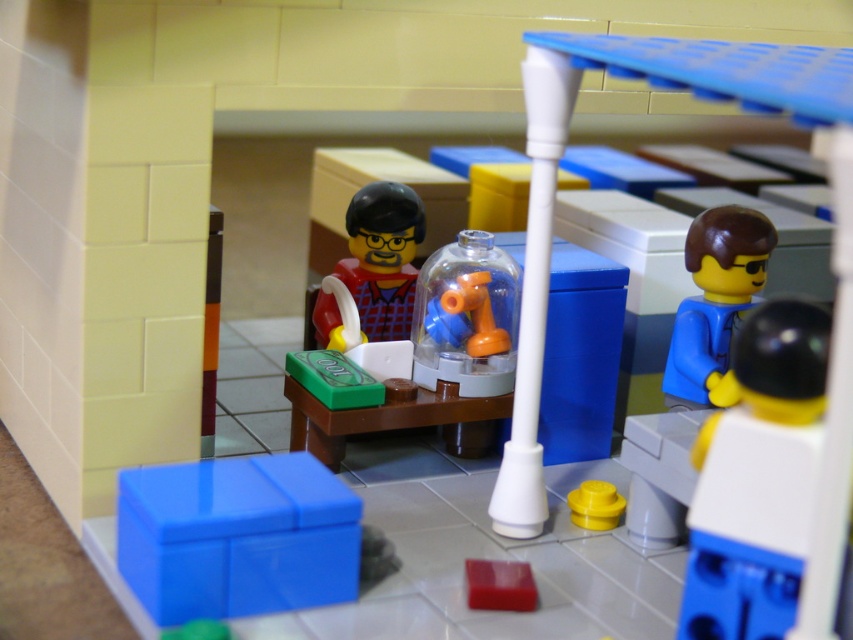
Can you confirm if white plastic figure at right is smaller than orange matte faucet at center?

No, white plastic figure at right is not smaller than orange matte faucet at center.

Is white plastic figure at right bigger than orange matte faucet at center?

Yes.

The width and height of the screenshot is (853, 640). In order to click on white plastic figure at right in this screenshot , I will do `click(757, 480)`.

Does white plastic figure at right have a lesser height compared to blue matte figure at right?

No.

Who is higher up, white plastic figure at right or blue matte figure at right?

blue matte figure at right

Image resolution: width=853 pixels, height=640 pixels. I want to click on white plastic figure at right, so click(757, 480).

Looking at this image, can you confirm if blue matte figure at right is positioned to the right of smooth red brick at lower center?

Yes, blue matte figure at right is to the right of smooth red brick at lower center.

Image resolution: width=853 pixels, height=640 pixels. In order to click on blue matte figure at right in this screenshot , I will do `click(715, 300)`.